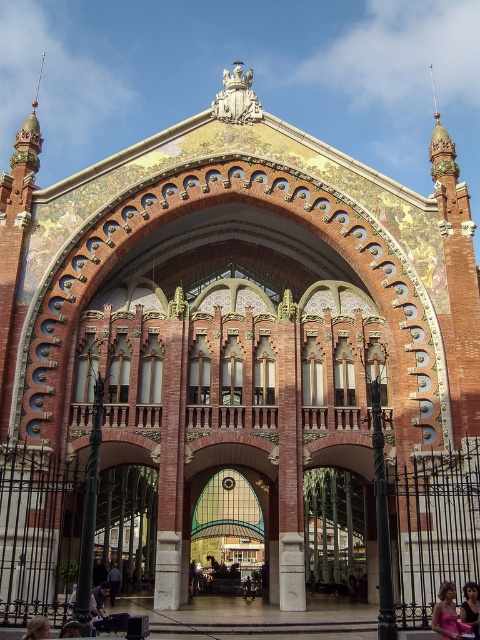
You are a customer at the Mercat de la Boqueria and you see a pink fabric dress at lower right and dark blue jeans at center. Which clothing item is placed higher up?

The pink fabric dress at lower right is positioned over the dark blue jeans at center, so the pink fabric dress at lower right is placed higher up.

You are a fashion designer visiting the Mercat de la Boqueria and notice the pink fabric dress at lower right and the dark blue jeans at center. Which item of clothing is smaller in size?

The pink fabric dress at lower right is smaller than the dark blue jeans at center.